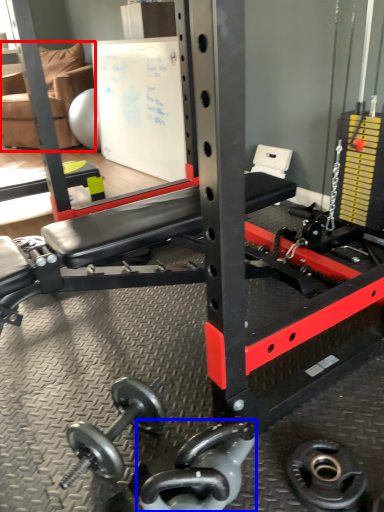
Question: Which of the following is the farthest to the observer, chair (highlighted by a red box) or dumbbell (highlighted by a blue box)?

Choices:
 (A) chair
 (B) dumbbell

Answer: (A)